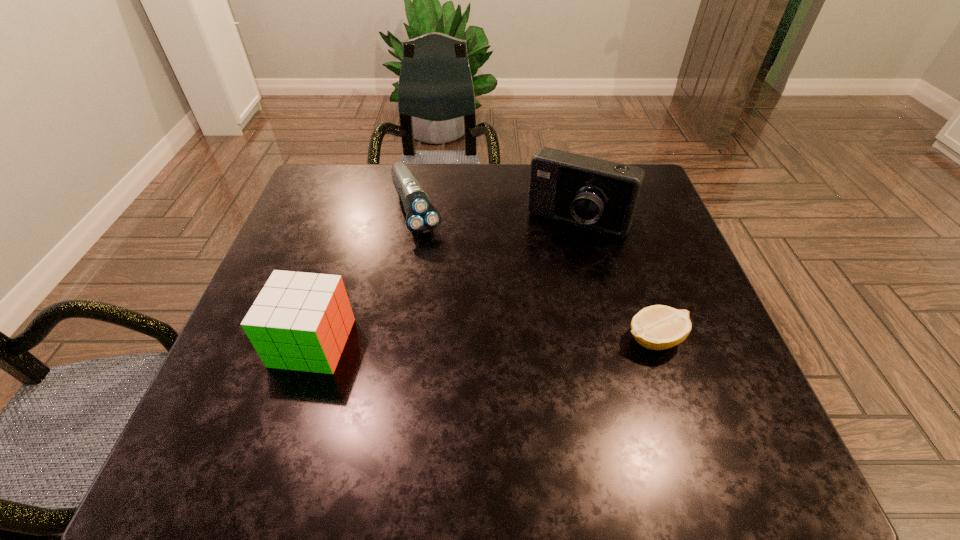
Locate an element on the screen. Image resolution: width=960 pixels, height=540 pixels. free spot between the shortest object and the electric shaver is located at coordinates (535, 274).

The image size is (960, 540). Identify the location of vacant region between the electric shaver and the leftmost object. (365, 276).

Identify the location of free space between the electric shaver and the cube. This screenshot has width=960, height=540. (365, 276).

This screenshot has width=960, height=540. What are the coordinates of `vacant region between the leftmost object and the lemon` in the screenshot? It's located at (483, 341).

Where is `vacant space that is in between the shortest object and the third shortest object`? The width and height of the screenshot is (960, 540). vacant space that is in between the shortest object and the third shortest object is located at coordinates (483, 341).

At what (x,y) coordinates should I click in order to perform the action: click on free space between the lemon and the second object from left to right. Please return your answer as a coordinate pair (x, y). Looking at the image, I should click on (535, 274).

Where is `vacant point located between the second shortest object and the third shortest object`? This screenshot has height=540, width=960. vacant point located between the second shortest object and the third shortest object is located at coordinates (365, 276).

Where is `empty space that is in between the shortest object and the second object from left to right`? Image resolution: width=960 pixels, height=540 pixels. empty space that is in between the shortest object and the second object from left to right is located at coordinates click(535, 274).

What are the coordinates of `object that is the closest to the tallest object` in the screenshot? It's located at (422, 217).

Locate an element on the screen. object that stands as the closest to the electric shaver is located at coordinates (595, 194).